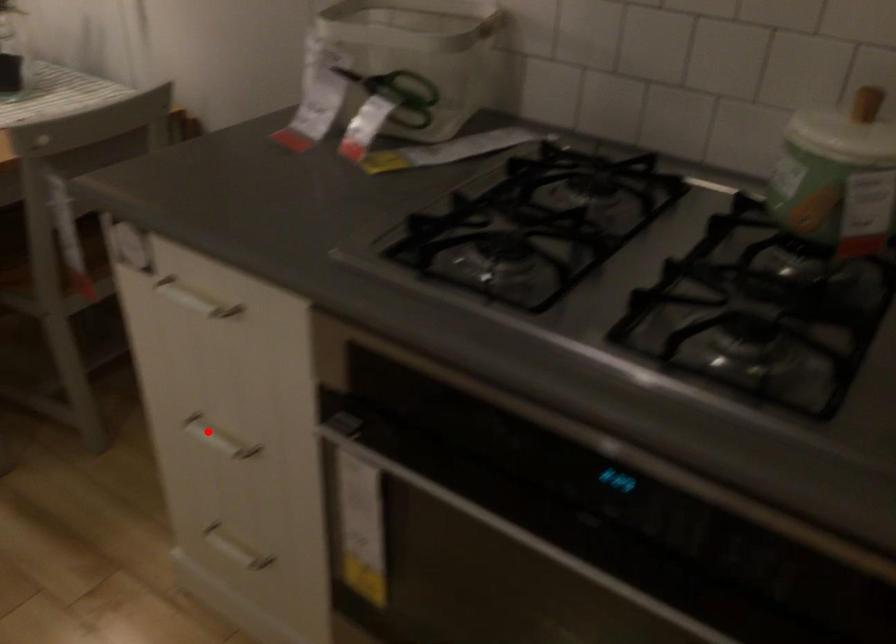
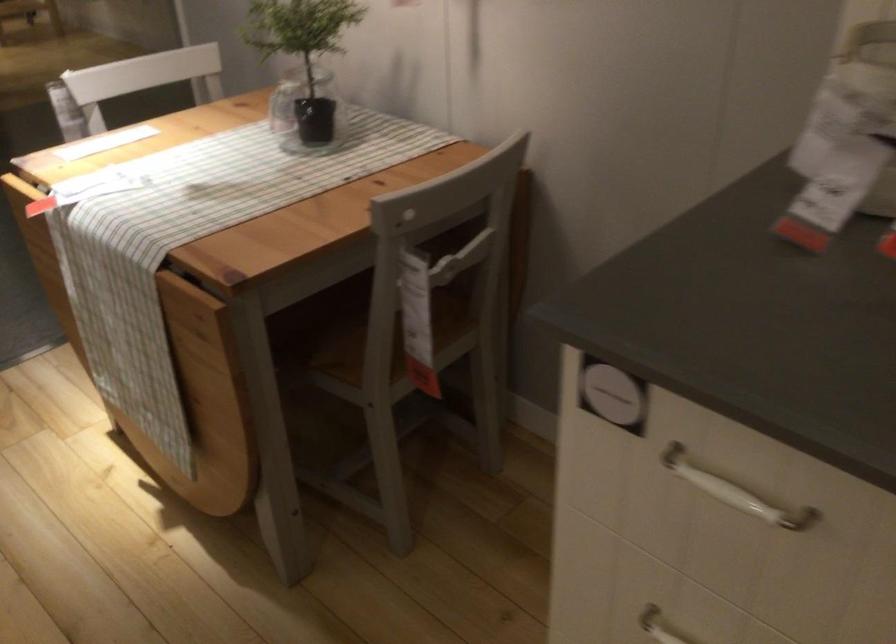
The point at the highlighted location is marked in the first image. Where is the corresponding point in the second image?

(659, 626)